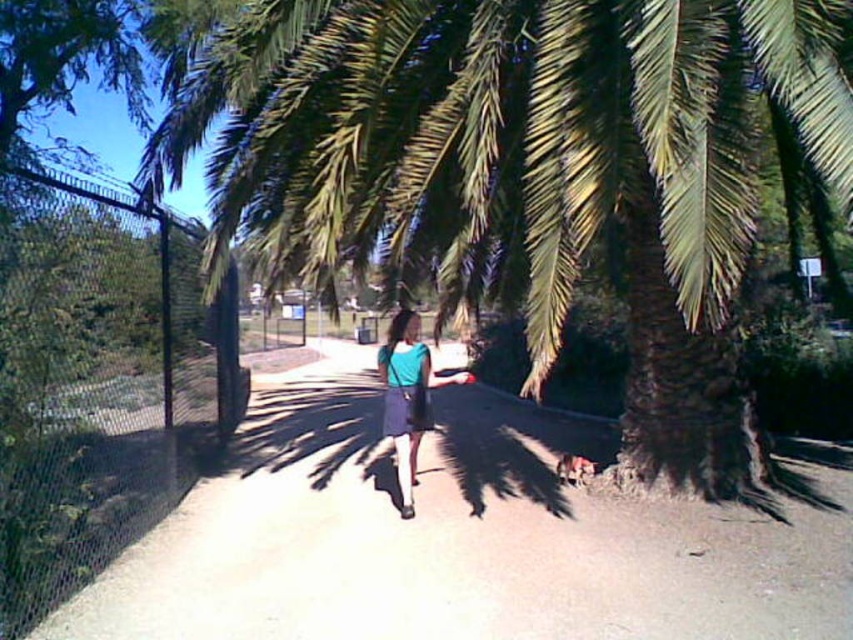
Between green leafy palm tree at center and blue fabric skirt at center, which one is positioned higher?

green leafy palm tree at center is above.

Can you confirm if green leafy palm tree at center is taller than blue fabric skirt at center?

Correct, green leafy palm tree at center is much taller as blue fabric skirt at center.

Is point (345, 182) less distant than point (410, 392)?

Yes, it is in front of point (410, 392).

At what (x,y) coordinates should I click in order to perform the action: click on green leafy palm tree at center. Please return your answer as a coordinate pair (x, y). The image size is (853, 640). Looking at the image, I should click on (531, 172).

Looking at this image, is light brown dirt path at center positioned before black chain-link fence at left?

That is False.

Can you confirm if light brown dirt path at center is positioned above black chain-link fence at left?

No, light brown dirt path at center is not above black chain-link fence at left.

Image resolution: width=853 pixels, height=640 pixels. Describe the element at coordinates (459, 536) in the screenshot. I see `light brown dirt path at center` at that location.

You are a GUI agent. You are given a task and a screenshot of the screen. Output one action in this format:
    pyautogui.click(x=<x>, y=<y>)
    Task: Click on the light brown dirt path at center
    This screenshot has height=640, width=853.
    Given the screenshot: What is the action you would take?
    click(x=459, y=536)

Who is shorter, green leafy palm tree at center or black chain-link fence at left?

With less height is green leafy palm tree at center.

Does green leafy palm tree at center come behind black chain-link fence at left?

Yes, green leafy palm tree at center is behind black chain-link fence at left.

Between point (671, 193) and point (26, 461), which one is positioned in front?

Point (671, 193)

The width and height of the screenshot is (853, 640). In order to click on green leafy palm tree at center in this screenshot , I will do `click(531, 172)`.